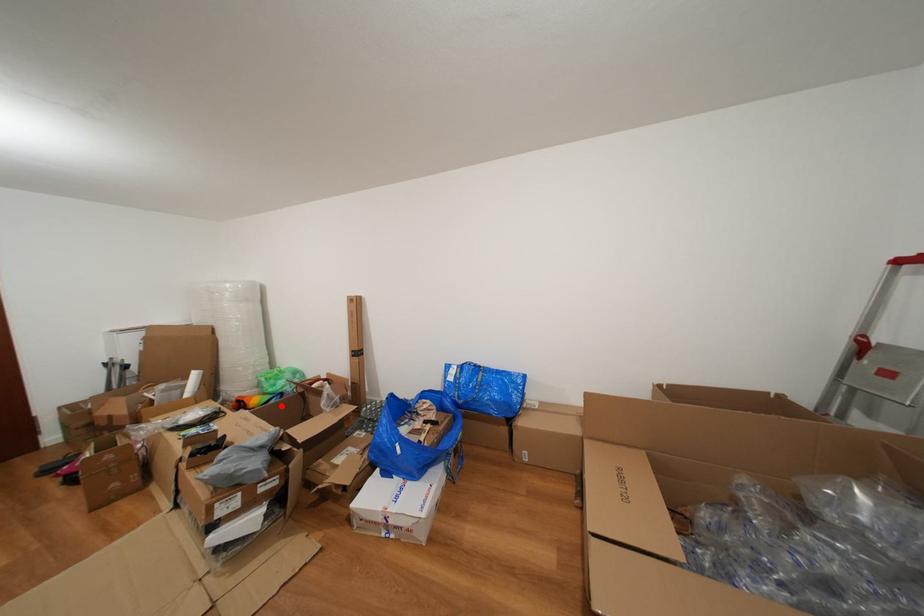
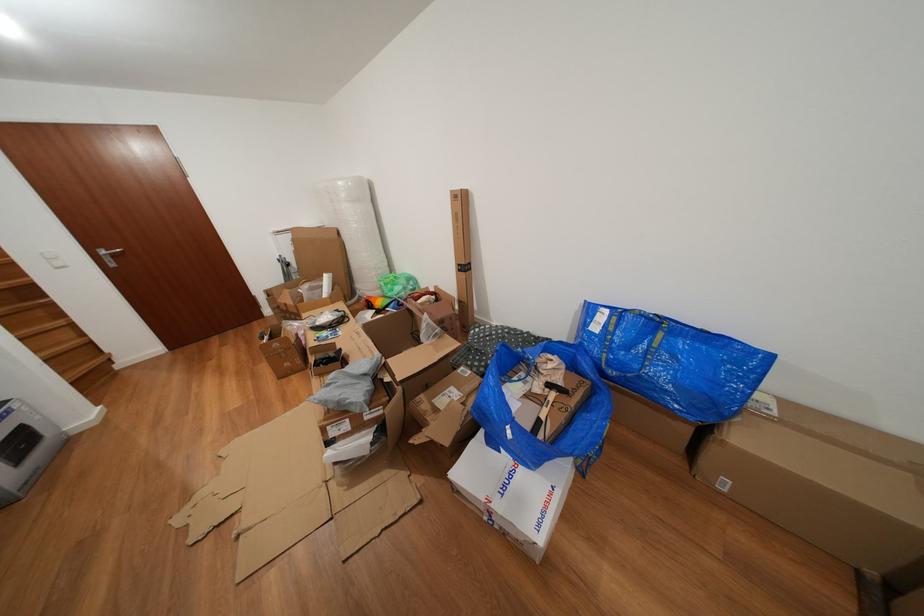
Question: I am providing you with two images of the same scene from different viewpoints. Image1 has a red point marked. In image2, the corresponding 3D location appears at what relative position? Reply with the corresponding letter.

Choices:
 (A) Closer
 (B) Farther

Answer: (B)